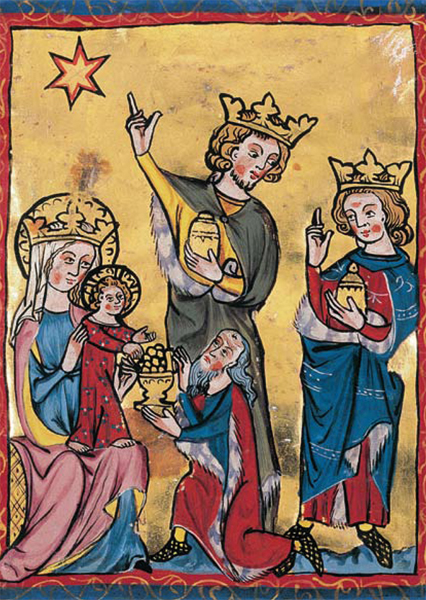
I want to click on painting, so click(210, 303).